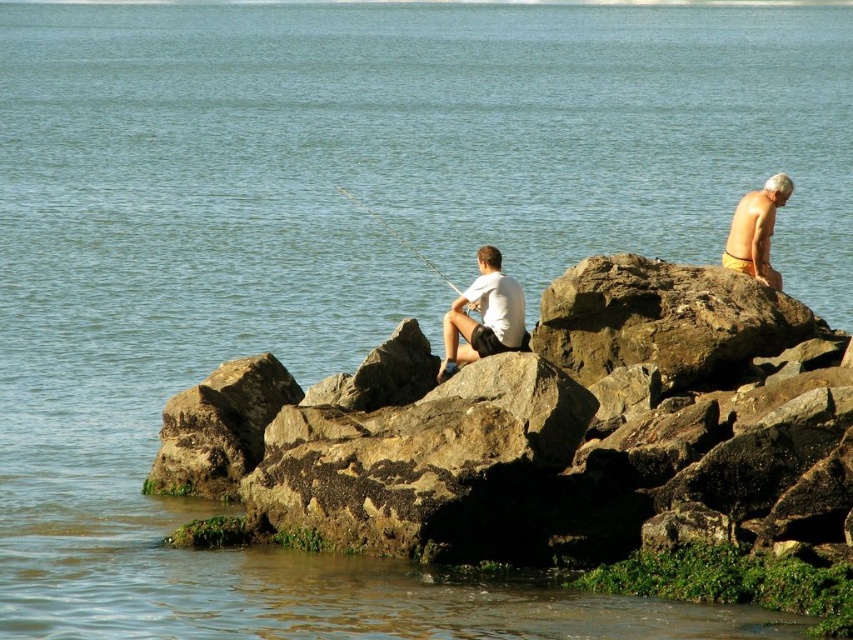
You are standing at the point labeled point (477, 355) and want to move towards the point labeled point (349, 195). Which direction should you move to get closer?

You should move away from the camera because point (477, 355) is closer to the camera than point (349, 195). Moving away from the camera would take you toward the farther point.

You are a photographer positioned at the camera location. You want to capture a photo that includes both the seated fisherman and the standing person. The seated fisherman is closer to the camera than the standing person. Is the point at coordinates point (734, 241) between them?

The distance of point (734, 241) from camera is 69.64 meters. Since the seated fisherman is closer to the camera than the standing person, the point at coordinates point (734, 241) is not between them because it is farther away from the camera than the seated fisherman.